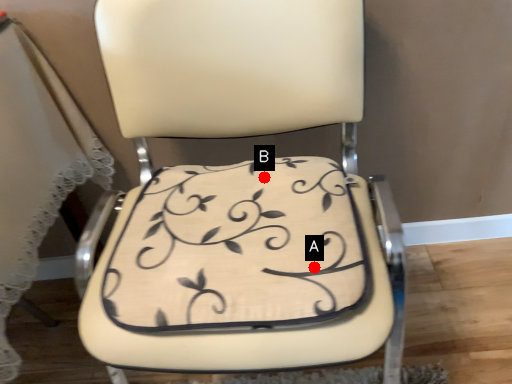
Question: Two points are circled on the image, labeled by A and B beside each circle. Which point appears farthest from the camera in this image?

Choices:
 (A) A is further
 (B) B is further

Answer: (B)